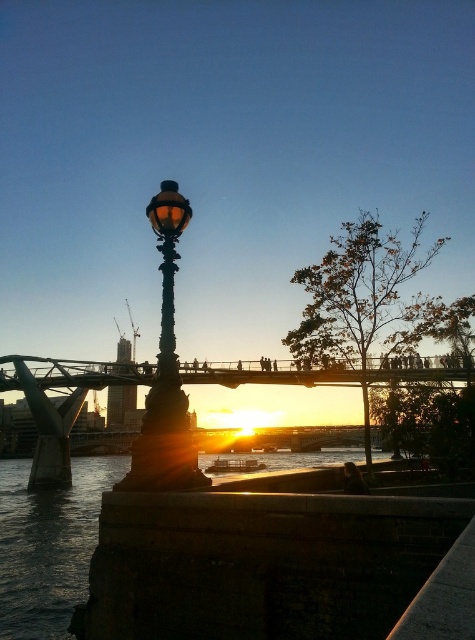
Is metallic bridge at center smaller than matte black street light at center?

Actually, metallic bridge at center might be larger than matte black street light at center.

Between metallic bridge at center and matte black street light at center, which one appears on the left side from the viewer's perspective?

Positioned to the left is metallic bridge at center.

Is point (333, 371) positioned behind point (158, 246)?

Yes, it is.

What are the coordinates of `metallic bridge at center` in the screenshot? It's located at (63, 404).